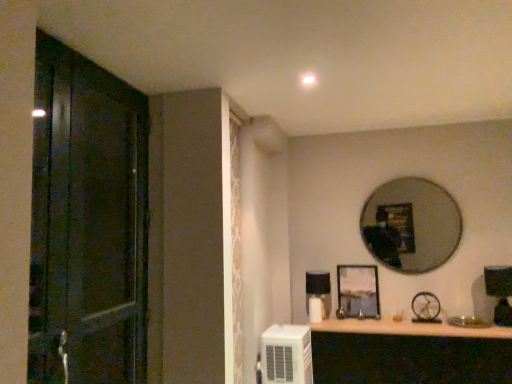
Question: Is metallic silver clock at upper right facing towards dark wood door at left?

Choices:
 (A) yes
 (B) no

Answer: (B)

Question: From the image's perspective, is metallic silver clock at upper right above dark wood door at left?

Choices:
 (A) yes
 (B) no

Answer: (B)

Question: Is metallic silver clock at upper right at the left side of dark wood door at left?

Choices:
 (A) no
 (B) yes

Answer: (A)

Question: Is metallic silver clock at upper right wider than dark wood door at left?

Choices:
 (A) no
 (B) yes

Answer: (A)

Question: Is metallic silver clock at upper right in front of dark wood door at left?

Choices:
 (A) yes
 (B) no

Answer: (B)

Question: Does point (45, 339) appear closer or farther from the camera than point (294, 329)?

Choices:
 (A) farther
 (B) closer

Answer: (B)

Question: From a real-world perspective, relative to white plastic air conditioner at lower right, is dark wood door at left vertically above or below?

Choices:
 (A) below
 (B) above

Answer: (B)

Question: Considering the positions of dark wood door at left and white plastic air conditioner at lower right in the image, is dark wood door at left wider or thinner than white plastic air conditioner at lower right?

Choices:
 (A) wide
 (B) thin

Answer: (B)

Question: In terms of height, does dark wood door at left look taller or shorter compared to white plastic air conditioner at lower right?

Choices:
 (A) short
 (B) tall

Answer: (B)

Question: Is point (74, 350) positioned closer to the camera than point (425, 299)?

Choices:
 (A) farther
 (B) closer

Answer: (B)

Question: Do you think dark wood door at left is within metallic silver clock at upper right, or outside of it?

Choices:
 (A) outside
 (B) inside

Answer: (A)

Question: Relative to metallic silver clock at upper right, is dark wood door at left in front or behind?

Choices:
 (A) front
 (B) behind

Answer: (A)

Question: Would you say dark wood door at left is to the left or to the right of metallic silver clock at upper right in the picture?

Choices:
 (A) left
 (B) right

Answer: (A)

Question: Is silver metallic mirror at upper right wider or thinner than metallic silver clock at upper right?

Choices:
 (A) wide
 (B) thin

Answer: (B)

Question: Is silver metallic mirror at upper right to the left or to the right of metallic silver clock at upper right in the image?

Choices:
 (A) right
 (B) left

Answer: (B)